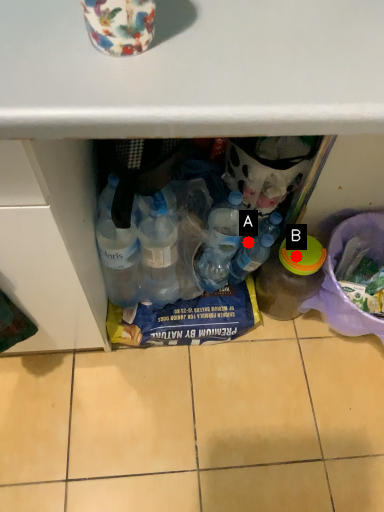
Question: Two points are circled on the image, labeled by A and B beside each circle. Which point is further to the camera?

Choices:
 (A) A is further
 (B) B is further

Answer: (A)